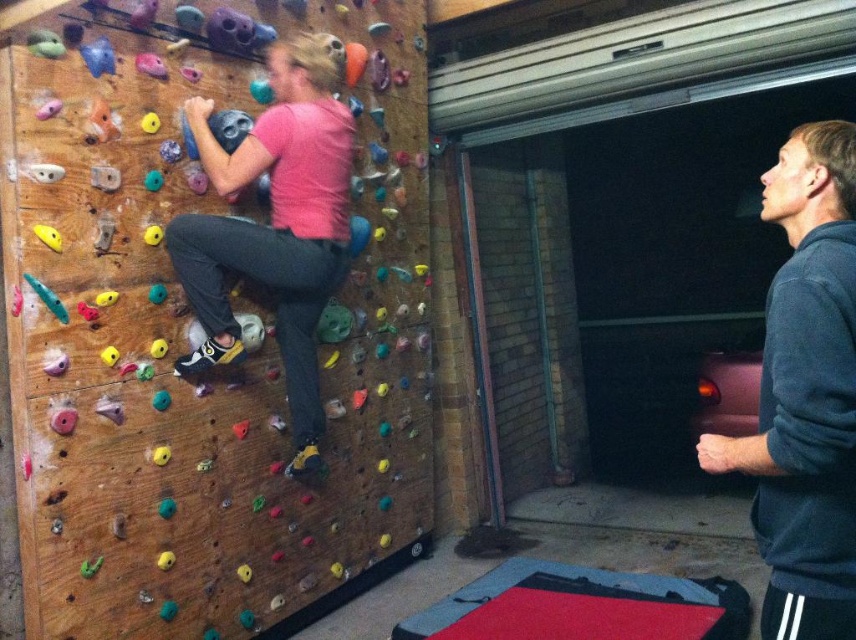
Question: Is wooden climbing wall at left below dark gray hoodie at right?

Choices:
 (A) yes
 (B) no

Answer: (B)

Question: Which of the following is the farthest from the observer?

Choices:
 (A) (195, 468)
 (B) (288, 221)
 (C) (801, 328)

Answer: (B)

Question: Is wooden climbing wall at left to the right of dark gray hoodie at right from the viewer's perspective?

Choices:
 (A) no
 (B) yes

Answer: (A)

Question: Among these objects, which one is nearest to the camera?

Choices:
 (A) wooden climbing wall at left
 (B) pink matte shirt at center
 (C) dark gray hoodie at right

Answer: (C)

Question: Which point is farther from the camera taking this photo?

Choices:
 (A) (801, 340)
 (B) (174, 547)

Answer: (B)

Question: Can you confirm if dark gray hoodie at right is smaller than pink matte shirt at center?

Choices:
 (A) no
 (B) yes

Answer: (B)